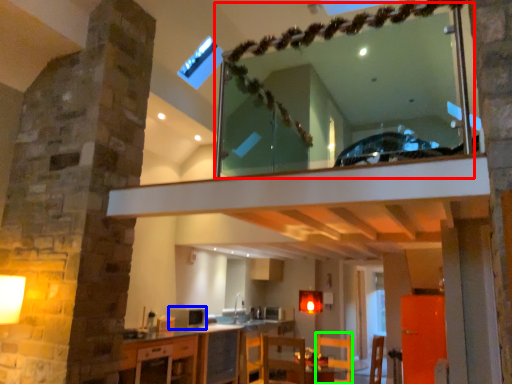
Question: Estimate the real-world distances between objects in this image. Which object is farther from mirror (highlighted by a red box), appliance (highlighted by a blue box) or armchair (highlighted by a green box)?

Choices:
 (A) appliance
 (B) armchair

Answer: (A)